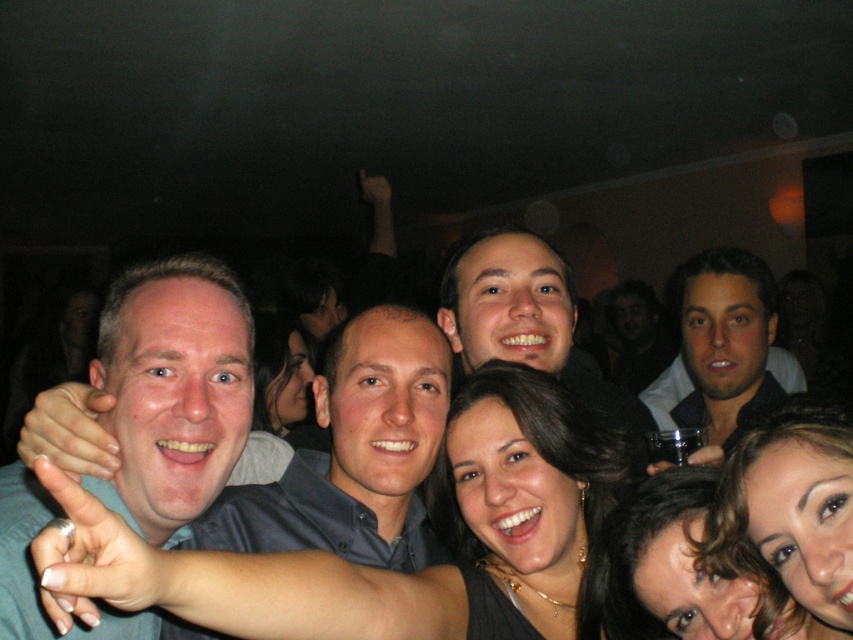
Does matte black hair at center come in front of matte gray shirt at lower left?

That is True.

Does matte black hair at center have a lesser width compared to matte gray shirt at lower left?

No, matte black hair at center is not thinner than matte gray shirt at lower left.

Locate an element on the screen. Image resolution: width=853 pixels, height=640 pixels. matte black hair at center is located at coordinates pos(389,570).

At what (x,y) coordinates should I click in order to perform the action: click on matte black hair at center. Please return your answer as a coordinate pair (x, y). Looking at the image, I should click on (389, 570).

Can you confirm if smooth skin face at center is positioned to the left of metallic silver ring at lower center?

Indeed, smooth skin face at center is positioned on the left side of metallic silver ring at lower center.

Is smooth skin face at center thinner than metallic silver ring at lower center?

In fact, smooth skin face at center might be wider than metallic silver ring at lower center.

What do you see at coordinates (527, 321) in the screenshot?
I see `smooth skin face at center` at bounding box center [527, 321].

Locate an element on the screen. smooth skin face at center is located at coordinates click(527, 321).

Is smooth brown hair at lower right shorter than smooth black hair at center?

Indeed, smooth brown hair at lower right has a lesser height compared to smooth black hair at center.

Is point (793, 630) in front of point (274, 342)?

Yes.

The image size is (853, 640). I want to click on smooth brown hair at lower right, so [662, 566].